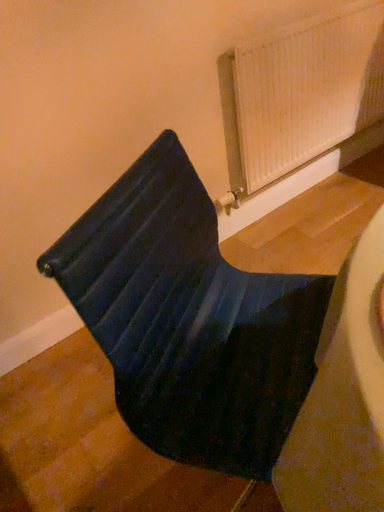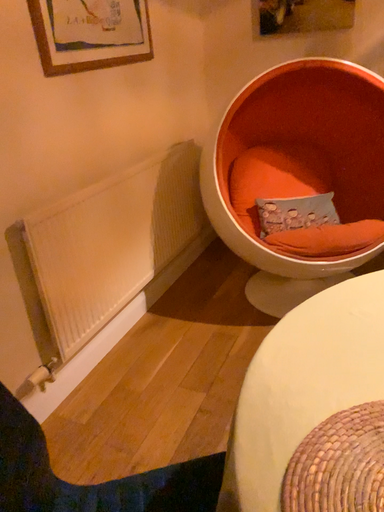
Question: How did the camera likely rotate when shooting the video?

Choices:
 (A) rotated right
 (B) rotated left

Answer: (A)